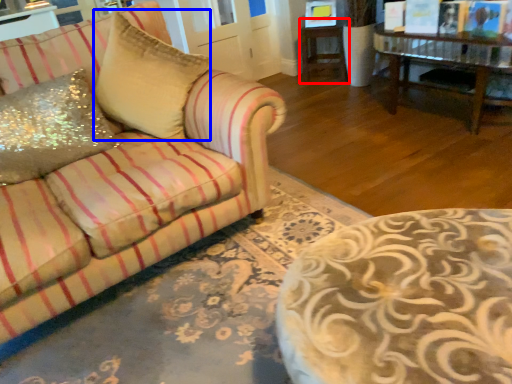
Question: Which object is closer to the camera taking this photo, side table (highlighted by a red box) or throw pillow (highlighted by a blue box)?

Choices:
 (A) side table
 (B) throw pillow

Answer: (B)